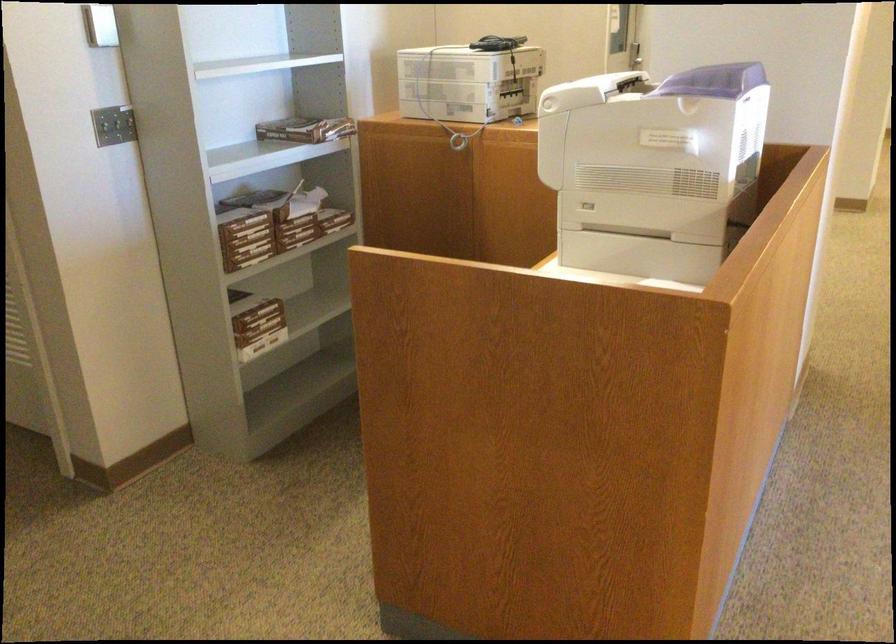
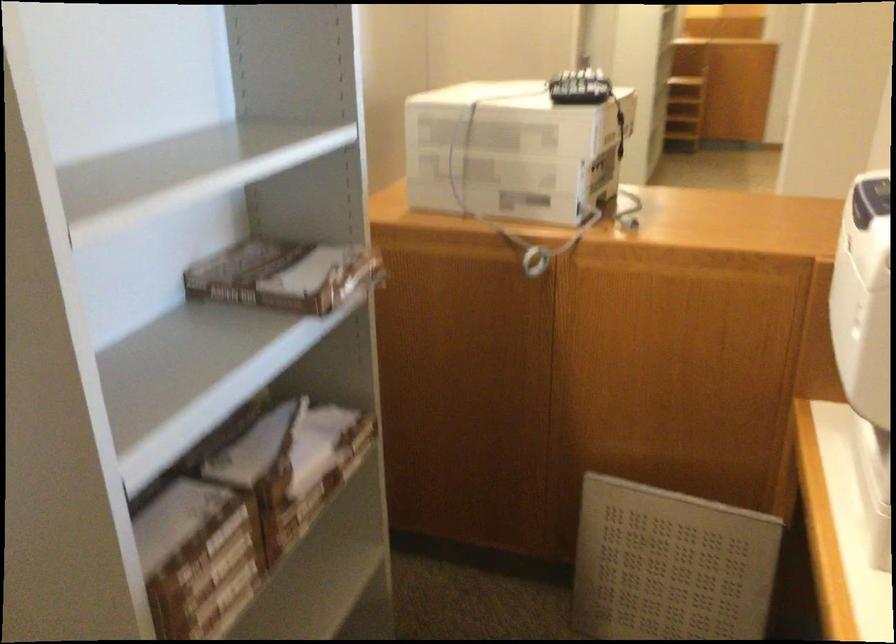
Locate, in the second image, the point that corresponds to [243,223] in the first image.

(209, 556)